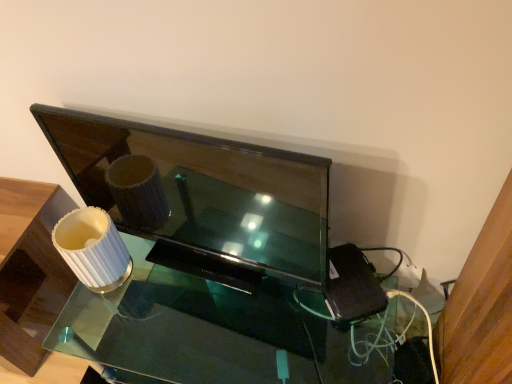
Question: Considering the relative positions of matte black tv at center and white ribbed lampshade at left in the image provided, is matte black tv at center to the left of white ribbed lampshade at left from the viewer's perspective?

Choices:
 (A) yes
 (B) no

Answer: (B)

Question: Does matte black tv at center have a greater width compared to white ribbed lampshade at left?

Choices:
 (A) no
 (B) yes

Answer: (A)

Question: From a real-world perspective, is matte black tv at center located beneath white ribbed lampshade at left?

Choices:
 (A) yes
 (B) no

Answer: (B)

Question: From the image's perspective, does matte black tv at center appear lower than white ribbed lampshade at left?

Choices:
 (A) yes
 (B) no

Answer: (B)

Question: Is matte black tv at center with white ribbed lampshade at left?

Choices:
 (A) yes
 (B) no

Answer: (B)

Question: Does point (366, 367) appear closer or farther from the camera than point (237, 144)?

Choices:
 (A) farther
 (B) closer

Answer: (A)

Question: From a real-world perspective, is clear glass table at center positioned above or below matte black tv at center?

Choices:
 (A) below
 (B) above

Answer: (A)

Question: From the image's perspective, is clear glass table at center located above or below matte black tv at center?

Choices:
 (A) above
 (B) below

Answer: (B)

Question: In the image, is clear glass table at center positioned in front of or behind matte black tv at center?

Choices:
 (A) behind
 (B) front

Answer: (A)

Question: From a real-world perspective, is white ribbed lampshade at left physically located above or below matte black tv at center?

Choices:
 (A) above
 (B) below

Answer: (B)

Question: Is point (24, 201) positioned closer to the camera than point (101, 178)?

Choices:
 (A) farther
 (B) closer

Answer: (A)

Question: Considering their positions, is white ribbed lampshade at left located in front of or behind matte black tv at center?

Choices:
 (A) front
 (B) behind

Answer: (B)

Question: Would you say white ribbed lampshade at left is inside or outside matte black tv at center?

Choices:
 (A) outside
 (B) inside

Answer: (A)

Question: From the image's perspective, is matte black tv at center located above or below clear glass table at center?

Choices:
 (A) below
 (B) above

Answer: (B)

Question: Is matte black tv at center wider or thinner than clear glass table at center?

Choices:
 (A) wide
 (B) thin

Answer: (B)